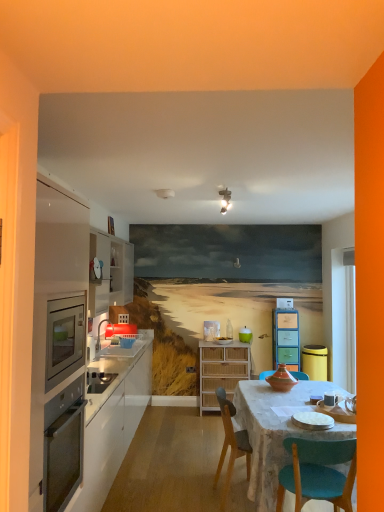
Where is `bamboo cabinet at center, marked as the 3th cabinetry in a front-to-back arrangement`? Image resolution: width=384 pixels, height=512 pixels. bamboo cabinet at center, marked as the 3th cabinetry in a front-to-back arrangement is located at coordinates (221, 370).

Image resolution: width=384 pixels, height=512 pixels. Describe the element at coordinates (312, 420) in the screenshot. I see `white ceramic plate at center` at that location.

What is the approximate height of wooden chair at center?

wooden chair at center is 32.81 inches in height.

Identify the location of satin white cabinetry at left, positioned as the fourth cabinetry in back-to-front order. (57, 324).

The width and height of the screenshot is (384, 512). I want to click on marble table at center, so click(277, 430).

Can you see pastel multi-colored cabinet at center, marked as the 1th cabinetry in a back-to-front arrangement, touching white glossy cabinetry at left, the 4th cabinetry when ordered from right to left?

No.

Is pastel multi-colored cabinet at center, which is counted as the 4th cabinetry, starting from the left, oriented away from white glossy cabinetry at left, the 4th cabinetry when ordered from right to left?

No, pastel multi-colored cabinet at center, which is counted as the 4th cabinetry, starting from the left, is not facing away from white glossy cabinetry at left, the 4th cabinetry when ordered from right to left.

Between pastel multi-colored cabinet at center, which ranks as the 4th cabinetry in front-to-back order, and white glossy cabinetry at left, the 4th cabinetry when ordered from right to left, which one has smaller width?

Thinner between the two is pastel multi-colored cabinet at center, which ranks as the 4th cabinetry in front-to-back order.

Would you say white glossy cabinetry at left, positioned as the first cabinetry in left-to-right order, is part of pastel multi-colored cabinet at center, which is counted as the 4th cabinetry, starting from the left,'s contents?

No, pastel multi-colored cabinet at center, which is counted as the 4th cabinetry, starting from the left, does not contain white glossy cabinetry at left, positioned as the first cabinetry in left-to-right order.

Considering the sizes of white ceramic plate at center and teal plastic cup at center in the image, is white ceramic plate at center taller or shorter than teal plastic cup at center?

In the image, white ceramic plate at center appears to be shorter than teal plastic cup at center.

Which is in front, white ceramic plate at center or teal plastic cup at center?

white ceramic plate at center is closer to the camera.

Which is more to the left, white ceramic plate at center or teal plastic cup at center?

teal plastic cup at center.

From a real-world perspective, is white ceramic plate at center on top of teal plastic cup at center?

Incorrect, from a real-world perspective, white ceramic plate at center is lower than teal plastic cup at center.

Is white ceramic plate at center behind satin white cabinetry at left, which ranks as the third cabinetry in right-to-left order?

Yes, it is.

Considering the points (300, 426) and (41, 228), which point is in front, point (300, 426) or point (41, 228)?

The point (41, 228) is closer to the camera.

Can we say white ceramic plate at center lies outside satin white cabinetry at left, which is counted as the 2th cabinetry, starting from the left?

Yes, white ceramic plate at center is outside of satin white cabinetry at left, which is counted as the 2th cabinetry, starting from the left.

Is matte white sink at left positioned with its back to pastel multi-colored cabinet at center, placed as the first cabinetry when sorted from right to left?

No, matte white sink at left's orientation is not away from pastel multi-colored cabinet at center, placed as the first cabinetry when sorted from right to left.

Between matte white sink at left and pastel multi-colored cabinet at center, placed as the first cabinetry when sorted from right to left, which one has smaller width?

pastel multi-colored cabinet at center, placed as the first cabinetry when sorted from right to left.

Does matte white sink at left lie in front of pastel multi-colored cabinet at center, placed as the first cabinetry when sorted from right to left?

Yes.

How distant is matte white sink at left from pastel multi-colored cabinet at center, placed as the first cabinetry when sorted from right to left?

The distance of matte white sink at left from pastel multi-colored cabinet at center, placed as the first cabinetry when sorted from right to left, is 2.09 meters.

Is matte white sink at left wider or thinner than white ceramic plate at center?

Considering their sizes, matte white sink at left looks broader than white ceramic plate at center.

Is matte white sink at left touching white ceramic plate at center?

They are not placed beside each other.

Can you confirm if matte white sink at left is bigger than white ceramic plate at center?

Yes, matte white sink at left is bigger than white ceramic plate at center.

Is matte white sink at left oriented towards white ceramic plate at center?

No, matte white sink at left is not facing towards white ceramic plate at center.

Is point (292, 415) closer to viewer compared to point (87, 476)?

No.

Is white ceramic plate at center looking in the opposite direction of white glossy cabinetry at left, the 3th cabinetry from the back?

No.

Which of these two, white ceramic plate at center or white glossy cabinetry at left, the 4th cabinetry when ordered from right to left, stands shorter?

white ceramic plate at center is shorter.

The width and height of the screenshot is (384, 512). I want to click on the 1st cabinetry in front of the white ceramic plate at center, counting from the anchor's position, so click(x=112, y=422).

This screenshot has width=384, height=512. Identify the location of tableware above the marble table at center (from the image's perspective). (312, 420).

Visually, is marble table at center positioned to the left or to the right of white ceramic plate at center?

marble table at center is positioned on white ceramic plate at center's right side.

Does marble table at center have a lesser height compared to white ceramic plate at center?

Incorrect, the height of marble table at center does not fall short of that of white ceramic plate at center.

Which of these two, marble table at center or white ceramic plate at center, is smaller?

white ceramic plate at center is smaller.

Find the location of a particular element. the 1st cabinetry below the pastel multi-colored cabinet at center, which is counted as the 4th cabinetry, starting from the left (from the image's perspective) is located at coordinates (112, 422).

In the image, there is a teal plastic cup at center. In order to click on tableware below it (from a real-world perspective) in this screenshot , I will do `click(312, 420)`.

Estimate the real-world distances between objects in this image. Which object is further from teal plastic cup at center, marble table at center or white ceramic plate at center?

white ceramic plate at center is further to teal plastic cup at center.

Considering their positions, is matte white sink at left positioned closer to wooden chair at center than marble table at center?

marble table at center is positioned closer to the anchor wooden chair at center.

Considering their positions, is wooden chair at center positioned closer to pastel multi-colored cabinet at center, marked as the 1th cabinetry in a back-to-front arrangement, than white glossy cabinetry at left, the 4th cabinetry when ordered from right to left?

Based on the image, white glossy cabinetry at left, the 4th cabinetry when ordered from right to left, appears to be nearer to pastel multi-colored cabinet at center, marked as the 1th cabinetry in a back-to-front arrangement.

Considering their positions, is wooden chair at center positioned further to white glossy cabinetry at left, which ranks as the 2th cabinetry in front-to-back order, than teal plastic cup at center?

teal plastic cup at center.

When comparing their distances from matte white sink at left, does pastel multi-colored cabinet at center, which ranks as the 4th cabinetry in front-to-back order, or marble table at center seem further?

Based on the image, pastel multi-colored cabinet at center, which ranks as the 4th cabinetry in front-to-back order, appears to be further to matte white sink at left.

Estimate the real-world distances between objects in this image. Which object is further from white glossy cabinetry at left, the 3th cabinetry from the back, teal plastic cup at center or matte white sink at left?

teal plastic cup at center lies further to white glossy cabinetry at left, the 3th cabinetry from the back, than the other object.

Estimate the real-world distances between objects in this image. Which object is closer to matte white sink at left, white ceramic plate at center or marble table at center?

The object closer to matte white sink at left is marble table at center.

Based on their spatial positions, is teal plastic cup at center or wooden chair at center closer to pastel multi-colored cabinet at center, which is counted as the 4th cabinetry, starting from the left?

teal plastic cup at center lies closer to pastel multi-colored cabinet at center, which is counted as the 4th cabinetry, starting from the left, than the other object.

At what (x,y) coordinates should I click in order to perform the action: click on chair located between white glossy cabinetry at left, which ranks as the 2th cabinetry in front-to-back order, and white ceramic plate at center in the left-right direction. Please return your answer as a coordinate pair (x, y). This screenshot has width=384, height=512. Looking at the image, I should click on (231, 444).

Where is `tableware located between white glossy cabinetry at left, which ranks as the 2th cabinetry in front-to-back order, and pastel multi-colored cabinet at center, marked as the 1th cabinetry in a back-to-front arrangement, in the depth direction`? The width and height of the screenshot is (384, 512). tableware located between white glossy cabinetry at left, which ranks as the 2th cabinetry in front-to-back order, and pastel multi-colored cabinet at center, marked as the 1th cabinetry in a back-to-front arrangement, in the depth direction is located at coordinates (312, 420).

Locate an element on the screen. tableware between satin white cabinetry at left, which ranks as the third cabinetry in right-to-left order, and matte white sink at left from front to back is located at coordinates (312, 420).

You are a GUI agent. You are given a task and a screenshot of the screen. Output one action in this format:
    pyautogui.click(x=<x>, y=<y>)
    Task: Click on the desk between satin white cabinetry at left, which ranks as the third cabinetry in right-to-left order, and matte white sink at left, along the z-axis
    The image size is (384, 512).
    Given the screenshot: What is the action you would take?
    pyautogui.click(x=277, y=430)